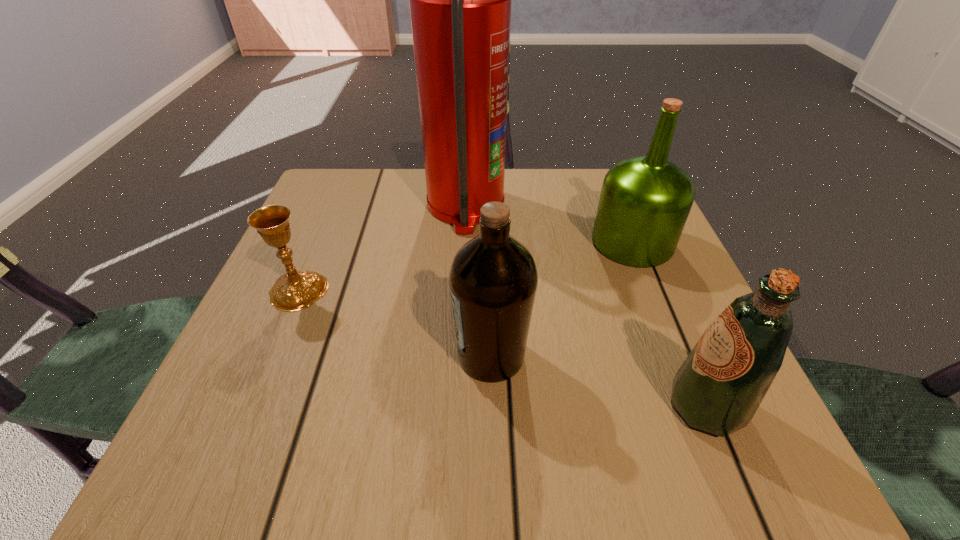
Locate an element on the screen. free spot located on the right of the chalice is located at coordinates (388, 291).

This screenshot has height=540, width=960. I want to click on fire extinguisher that is at the far edge, so click(460, 0).

The image size is (960, 540). I want to click on olive oil present at the far edge, so click(x=645, y=201).

Where is `object situated at the near edge`? object situated at the near edge is located at coordinates (720, 385).

In order to click on object that is positioned at the left edge in this screenshot , I will do `click(294, 290)`.

The width and height of the screenshot is (960, 540). I want to click on object located at the far right corner, so click(645, 201).

Locate an element on the screen. The height and width of the screenshot is (540, 960). object that is at the near right corner is located at coordinates (720, 385).

Locate an element on the screen. vacant space at the far edge of the desktop is located at coordinates (570, 207).

In the image, there is a desktop. Where is `vacant region at the left edge`? vacant region at the left edge is located at coordinates (315, 271).

In order to click on vacant area at the right edge in this screenshot , I will do `click(660, 354)`.